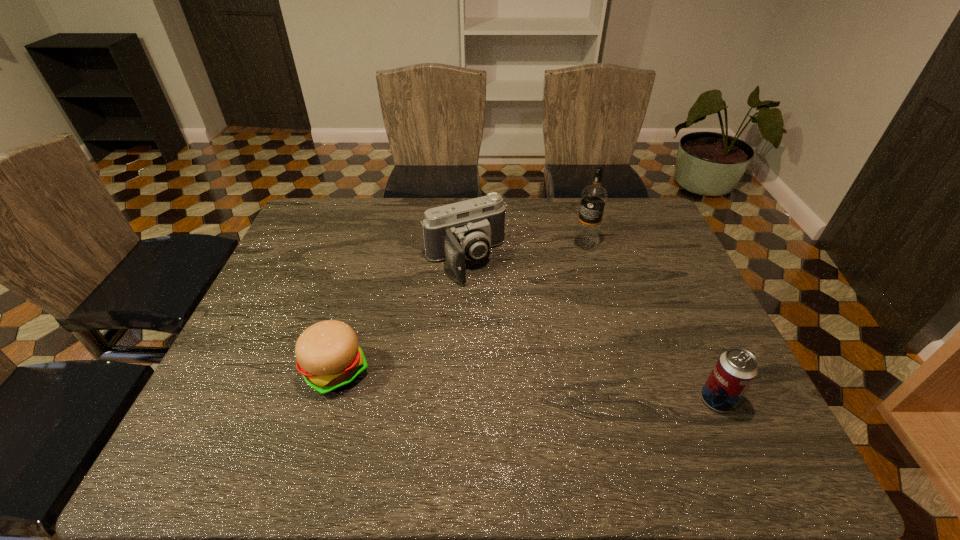
Locate an element on the screen. This screenshot has height=540, width=960. free space located on the label of the vodka is located at coordinates click(x=555, y=280).

Find the location of a particular element. The width and height of the screenshot is (960, 540). blank space located 0.080m at the front of the camera with an open lens cover is located at coordinates (493, 304).

Identify the location of blank space located at the front of the camera with an open lens cover. The height and width of the screenshot is (540, 960). (510, 329).

At what (x,y) coordinates should I click in order to perform the action: click on vacant region located at the front of the camera with an open lens cover. Please return your answer as a coordinate pair (x, y). This screenshot has width=960, height=540. Looking at the image, I should click on (507, 325).

Image resolution: width=960 pixels, height=540 pixels. What are the coordinates of `vodka situated at the far edge` in the screenshot? It's located at (593, 199).

You are a GUI agent. You are given a task and a screenshot of the screen. Output one action in this format:
    pyautogui.click(x=<x>, y=<y>)
    Task: Click on the camera present at the far edge
    This screenshot has height=540, width=960.
    Given the screenshot: What is the action you would take?
    pyautogui.click(x=468, y=229)

This screenshot has height=540, width=960. I want to click on hamburger present at the near edge, so click(329, 357).

Where is `beer can present at the near edge`? The width and height of the screenshot is (960, 540). beer can present at the near edge is located at coordinates (736, 368).

This screenshot has height=540, width=960. Identify the location of object located in the right edge section of the desktop. (736, 368).

Where is `object at the near right corner`? object at the near right corner is located at coordinates (736, 368).